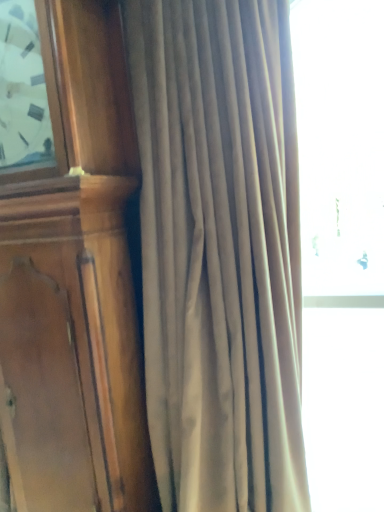
Question: Is wooden clock at left wider or thinner than satin beige curtain at center?

Choices:
 (A) thin
 (B) wide

Answer: (A)

Question: Is wooden clock at left bigger or smaller than satin beige curtain at center?

Choices:
 (A) big
 (B) small

Answer: (B)

Question: From the image's perspective, is wooden clock at left above or below satin beige curtain at center?

Choices:
 (A) below
 (B) above

Answer: (B)

Question: In the image, is satin beige curtain at center positioned in front of or behind wooden clock at left?

Choices:
 (A) behind
 (B) front

Answer: (B)

Question: Is point (274, 309) positioned closer to the camera than point (1, 466)?

Choices:
 (A) farther
 (B) closer

Answer: (B)

Question: Based on their positions, is satin beige curtain at center located to the left or right of wooden clock at left?

Choices:
 (A) right
 (B) left

Answer: (A)

Question: From a real-world perspective, relative to wooden clock at left, is satin beige curtain at center vertically above or below?

Choices:
 (A) below
 (B) above

Answer: (A)